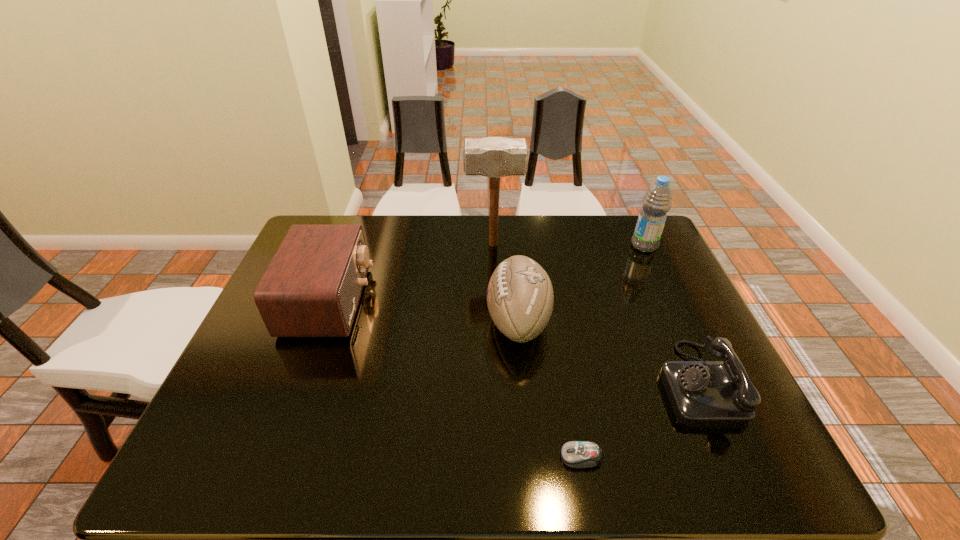
The image size is (960, 540). I want to click on free region located on the wheel side of the computer mouse, so click(x=510, y=457).

Locate an element on the screen. The width and height of the screenshot is (960, 540). mallet that is at the far edge is located at coordinates (494, 157).

Find the location of a particular element. Image resolution: width=960 pixels, height=540 pixels. water bottle situated at the far edge is located at coordinates (657, 201).

Where is `object that is at the near edge`? object that is at the near edge is located at coordinates (576, 454).

This screenshot has width=960, height=540. I want to click on object that is at the left edge, so click(x=312, y=287).

The image size is (960, 540). Find the location of `water bottle that is at the right edge`. water bottle that is at the right edge is located at coordinates (657, 201).

This screenshot has width=960, height=540. What are the coordinates of `telephone located at the right edge` in the screenshot? It's located at (702, 393).

The height and width of the screenshot is (540, 960). Identify the location of object at the far right corner. (657, 201).

Where is `vacant space at the far edge`? This screenshot has width=960, height=540. vacant space at the far edge is located at coordinates (514, 255).

The image size is (960, 540). Identify the location of blank space at the near edge. (288, 455).